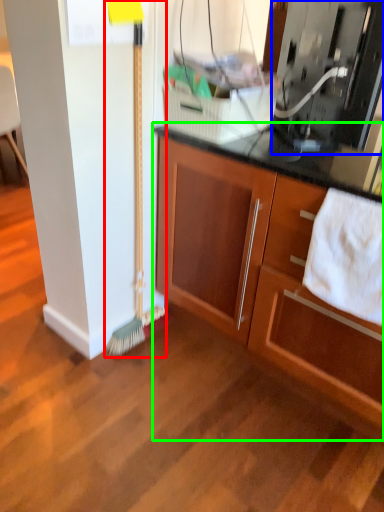
Question: Which is farther away from brush (highlighted by a red box)? appliance (highlighted by a blue box) or cabinetry (highlighted by a green box)?

Choices:
 (A) appliance
 (B) cabinetry

Answer: (A)